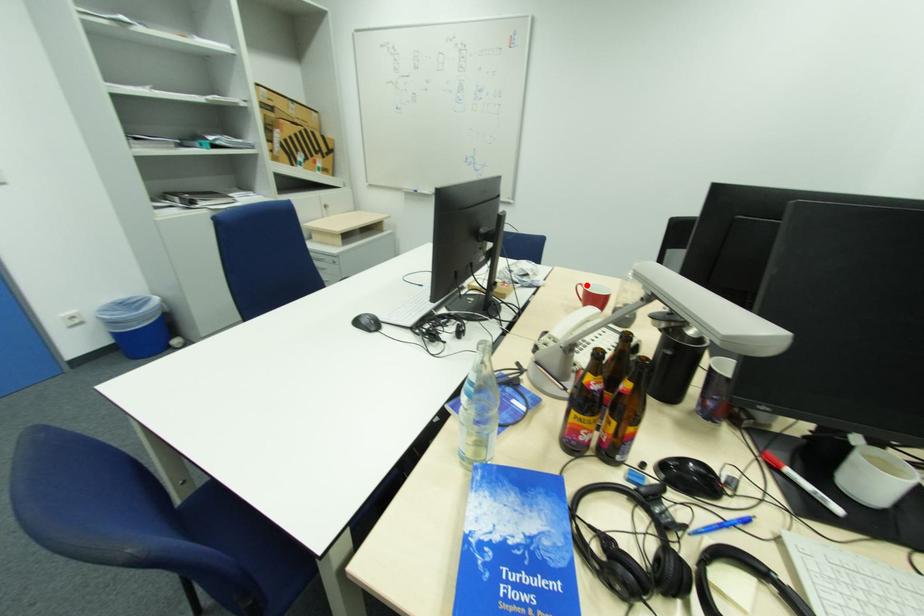
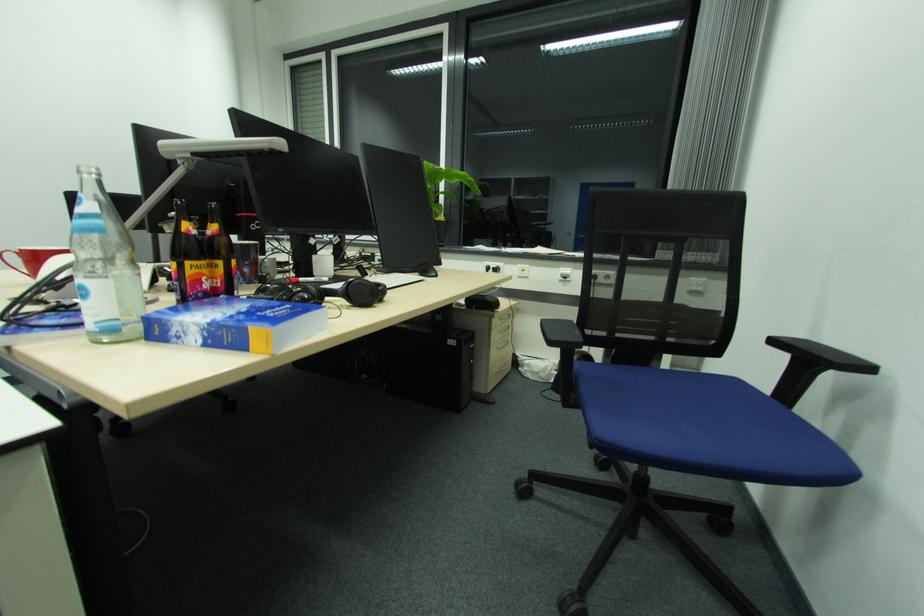
The point at the highlighted location is marked in the first image. Where is the corresponding point in the second image?

(15, 254)